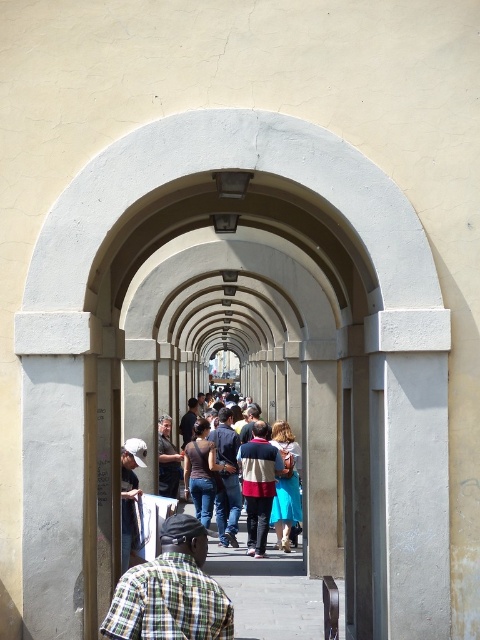
Between matte brown skirt at center and matte brown shirt at center, which one has more height?

matte brown shirt at center

From the picture: Who is more distant from viewer, (283, 432) or (206, 504)?

Point (283, 432)

Is point (283, 440) positioned behind point (205, 429)?

No, (283, 440) is in front of (205, 429).

The image size is (480, 640). I want to click on matte brown skirt at center, so coord(286,484).

Is point (268, 472) farther from camera compared to point (279, 547)?

No, it is not.

Does striped sweater at center appear on the left side of matte brown skirt at center?

Correct, you'll find striped sweater at center to the left of matte brown skirt at center.

The height and width of the screenshot is (640, 480). What do you see at coordinates (259, 484) in the screenshot?
I see `striped sweater at center` at bounding box center [259, 484].

At what (x,y) coordinates should I click in order to perform the action: click on striped sweater at center. Please return your answer as a coordinate pair (x, y). Image resolution: width=480 pixels, height=640 pixels. Looking at the image, I should click on (259, 484).

Can you confirm if striped sweater at center is smaller than denim jeans at center?

Correct, striped sweater at center occupies less space than denim jeans at center.

Does point (259, 522) come in front of point (233, 516)?

Yes, it is.

This screenshot has width=480, height=640. Describe the element at coordinates (259, 484) in the screenshot. I see `striped sweater at center` at that location.

You are a GUI agent. You are given a task and a screenshot of the screen. Output one action in this format:
    pyautogui.click(x=<x>, y=<y>)
    Task: Click on the striped sweater at center
    
    Given the screenshot: What is the action you would take?
    pyautogui.click(x=259, y=484)